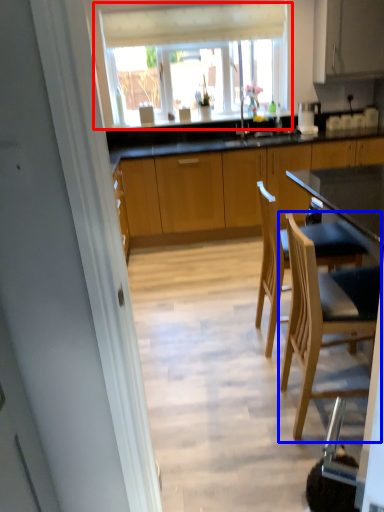
Question: Which object is closer to the camera taking this photo, window (highlighted by a red box) or chair (highlighted by a blue box)?

Choices:
 (A) window
 (B) chair

Answer: (B)